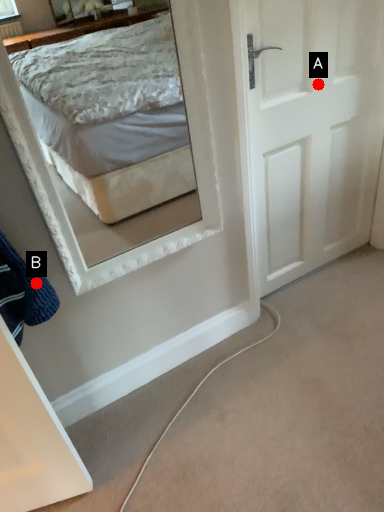
Question: Two points are circled on the image, labeled by A and B beside each circle. Among these points, which one is nearest to the camera?

Choices:
 (A) A is closer
 (B) B is closer

Answer: (B)